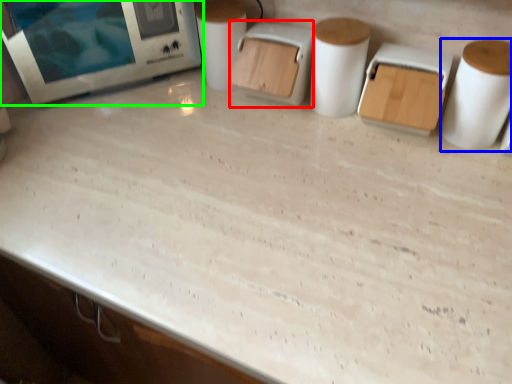
Question: Which object is positioned farthest from appliance (highlighted by a red box)? Select from paper towel (highlighted by a blue box) and home appliance (highlighted by a green box).

Choices:
 (A) paper towel
 (B) home appliance

Answer: (A)